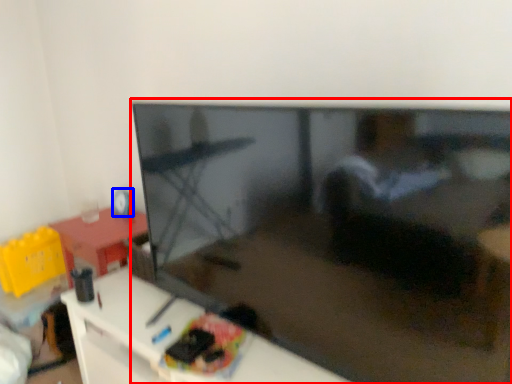
Question: Which object appears closest to the camera in this image, television (highlighted by a red box) or toy (highlighted by a blue box)?

Choices:
 (A) television
 (B) toy

Answer: (A)